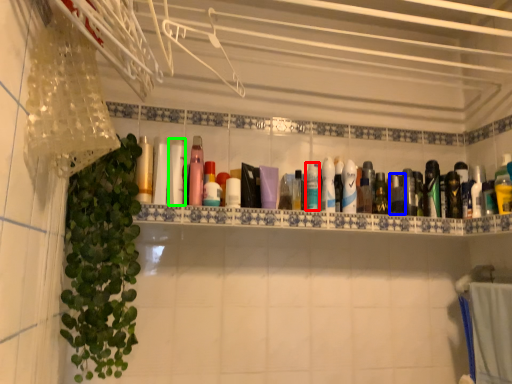
Question: Which object is the closest to the mouthwash (highlighted by a red box)? Choose among these: mouthwash (highlighted by a blue box) or mouthwash (highlighted by a green box).

Choices:
 (A) mouthwash
 (B) mouthwash

Answer: (A)